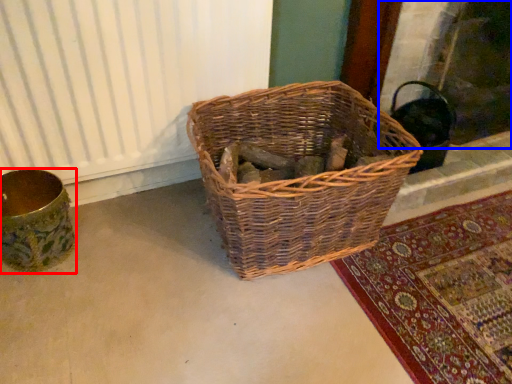
Question: Which object appears closest to the camera in this image, flower basket (highlighted by a red box) or fireplace (highlighted by a blue box)?

Choices:
 (A) flower basket
 (B) fireplace

Answer: (A)